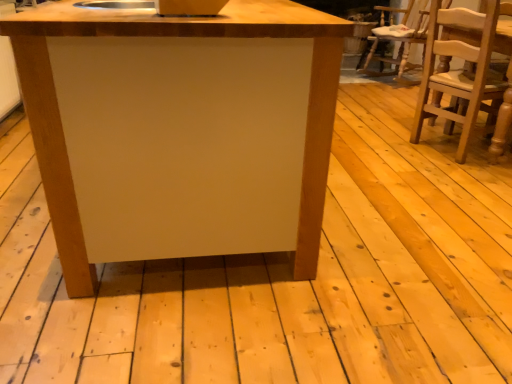
Image resolution: width=512 pixels, height=384 pixels. In order to click on vacant space behind light brown wooden chair at right in this screenshot , I will do `click(396, 127)`.